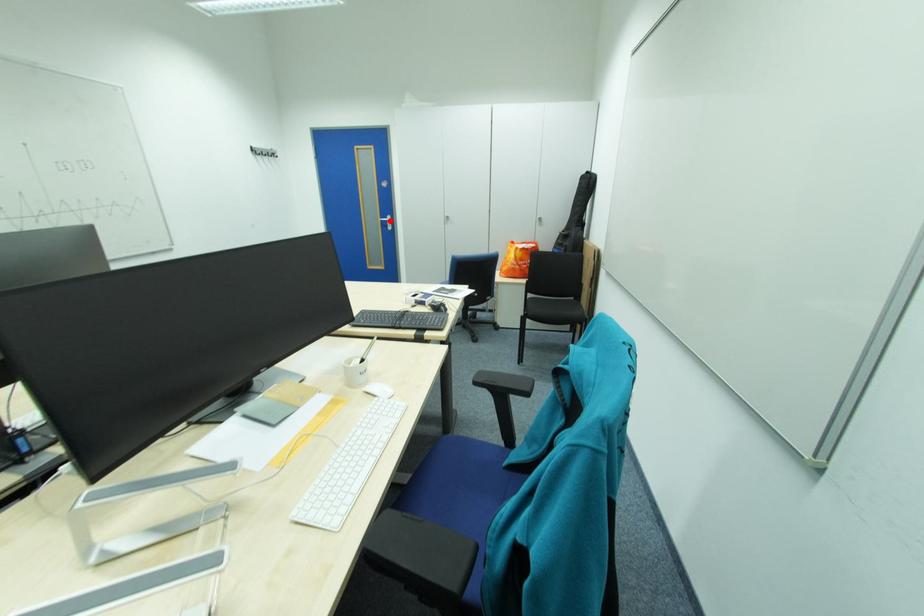
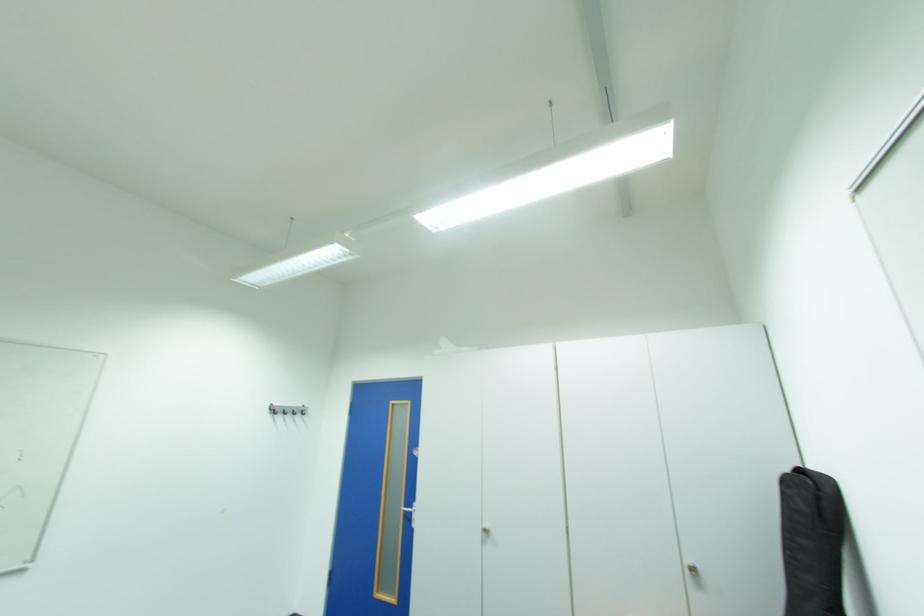
Question: I am providing you with two images of the same scene from different viewpoints. Image1 has a red point marked. In image2, the corresponding 3D location appears at what relative position? Reply with the corresponding letter.

Choices:
 (A) Closer
 (B) Farther

Answer: (B)